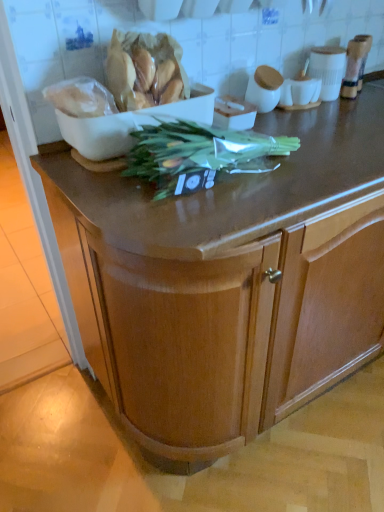
At what (x,y) coordinates should I click in order to perform the action: click on green leafy vegetable at center. Please return your answer as a coordinate pair (x, y). Looking at the image, I should click on (200, 155).

What is the approximate height of green leafy vegetable at center?

It is 13.18 centimeters.

The width and height of the screenshot is (384, 512). In order to click on white matte bowl at upper left in this screenshot , I will do `click(131, 124)`.

What do you see at coordinates (145, 70) in the screenshot? I see `translucent plastic bag of bread at upper left, the 2th food from the left` at bounding box center [145, 70].

The height and width of the screenshot is (512, 384). What do you see at coordinates (328, 69) in the screenshot?
I see `white glossy cup at upper right` at bounding box center [328, 69].

Consider the image. Measure the distance between point (325, 54) and camera.

Point (325, 54) and camera are 4.58 feet apart.

Locate an element on the screen. This screenshot has width=384, height=512. wooden cabinet at center is located at coordinates (229, 283).

Between wooden cabinet at center and white matte bowl at upper left, which one appears on the left side from the viewer's perspective?

white matte bowl at upper left.

Is white matte bowl at upper left completely or partially inside wooden cabinet at center?

Actually, white matte bowl at upper left is outside wooden cabinet at center.

From a real-world perspective, who is located lower, wooden cabinet at center or white matte bowl at upper left?

wooden cabinet at center.

Considering their positions, is wooden cabinet at center located in front of or behind white matte bowl at upper left?

wooden cabinet at center is in front of white matte bowl at upper left.

How much distance is there between white glossy cup at upper right and white matte bowl at upper left?

The distance of white glossy cup at upper right from white matte bowl at upper left is 62.50 centimeters.

Does white glossy cup at upper right have a lesser height compared to white matte bowl at upper left?

Incorrect, the height of white glossy cup at upper right does not fall short of that of white matte bowl at upper left.

Considering the relative sizes of white glossy cup at upper right and white matte bowl at upper left in the image provided, is white glossy cup at upper right wider than white matte bowl at upper left?

No, white glossy cup at upper right is not wider than white matte bowl at upper left.

From the image's perspective, is translucent plastic bag of bread at upper left, the 1th food when ordered from right to left, located above or below white plastic bag at upper left, positioned as the second food in right-to-left order?

translucent plastic bag of bread at upper left, the 1th food when ordered from right to left, is above white plastic bag at upper left, positioned as the second food in right-to-left order.

Is translucent plastic bag of bread at upper left, the 2th food from the left, looking in the opposite direction of white plastic bag at upper left, which appears as the 1th food when viewed from the left?

That's not correct — translucent plastic bag of bread at upper left, the 2th food from the left, is not looking away from white plastic bag at upper left, which appears as the 1th food when viewed from the left.

Is point (119, 59) positioned after point (69, 101)?

Yes, it is behind point (69, 101).

Is translucent plastic bag of bread at upper left, the 1th food when ordered from right to left, positioned behind white plastic bag at upper left, which appears as the 1th food when viewed from the left?

Yes, it is.

Between white plastic bag at upper left, which appears as the 1th food when viewed from the left, and translucent plastic bag of bread at upper left, the 2th food from the left, which one is positioned in front?

white plastic bag at upper left, which appears as the 1th food when viewed from the left.

Between white plastic bag at upper left, which appears as the 1th food when viewed from the left, and translucent plastic bag of bread at upper left, the 2th food from the left, which one has smaller width?

white plastic bag at upper left, which appears as the 1th food when viewed from the left.

How distant is white plastic bag at upper left, positioned as the second food in right-to-left order, from translucent plastic bag of bread at upper left, the 2th food from the left?

The distance of white plastic bag at upper left, positioned as the second food in right-to-left order, from translucent plastic bag of bread at upper left, the 2th food from the left, is 3.89 inches.

From the picture: From the image's perspective, is white plastic bag at upper left, which appears as the 1th food when viewed from the left, above translucent plastic bag of bread at upper left, the 2th food from the left?

Incorrect, from the image's perspective, white plastic bag at upper left, which appears as the 1th food when viewed from the left, is lower than translucent plastic bag of bread at upper left, the 2th food from the left.

Does point (135, 164) come in front of point (317, 52)?

Yes.

Is green leafy vegetable at center closer to the viewer compared to white glossy cup at upper right?

Yes, green leafy vegetable at center is closer to the viewer.

Is green leafy vegetable at center surrounding white glossy cup at upper right?

No, white glossy cup at upper right is located outside of green leafy vegetable at center.

Is green leafy vegetable at center shorter than white glossy cup at upper right?

Yes.

Between white plastic bag at upper left, which appears as the 1th food when viewed from the left, and white matte bowl at upper left, which one has smaller width?

Thinner between the two is white plastic bag at upper left, which appears as the 1th food when viewed from the left.

Is the position of white plastic bag at upper left, which appears as the 1th food when viewed from the left, more distant than that of white matte bowl at upper left?

No, white plastic bag at upper left, which appears as the 1th food when viewed from the left, is closer to the viewer.

From a real-world perspective, is white plastic bag at upper left, positioned as the second food in right-to-left order, physically below white matte bowl at upper left?

No, from a real-world perspective, white plastic bag at upper left, positioned as the second food in right-to-left order, is not under white matte bowl at upper left.

In terms of size, does white matte bowl at upper left appear bigger or smaller than translucent plastic bag of bread at upper left, the 2th food from the left?

white matte bowl at upper left is bigger than translucent plastic bag of bread at upper left, the 2th food from the left.

Between point (197, 116) and point (111, 41), which one is positioned in front?

The point (111, 41) is in front.

From a real-world perspective, relative to translucent plastic bag of bread at upper left, the 2th food from the left, is white matte bowl at upper left vertically above or below?

Clearly, from a real-world perspective, white matte bowl at upper left is below translucent plastic bag of bread at upper left, the 2th food from the left.

Is white matte bowl at upper left next to translucent plastic bag of bread at upper left, the 1th food when ordered from right to left?

Yes, white matte bowl at upper left is beside translucent plastic bag of bread at upper left, the 1th food when ordered from right to left.

The width and height of the screenshot is (384, 512). What are the coordinates of `cabinetry in front of the white matte bowl at upper left` in the screenshot? It's located at (229, 283).

The image size is (384, 512). In order to click on appliance located underneath the white matte bowl at upper left (from a real-world perspective) in this screenshot , I will do point(328,69).

Looking at the image, which one is located further to white plastic bag at upper left, positioned as the second food in right-to-left order, white glossy cup at upper right or white matte bowl at upper left?

Based on the image, white glossy cup at upper right appears to be further to white plastic bag at upper left, positioned as the second food in right-to-left order.

Looking at the image, which one is located closer to wooden cabinet at center, green leafy vegetable at center or white plastic bag at upper left, which appears as the 1th food when viewed from the left?

green leafy vegetable at center lies closer to wooden cabinet at center than the other object.

Which object lies further to the anchor point translucent plastic bag of bread at upper left, the 2th food from the left, green leafy vegetable at center or wooden cabinet at center?

wooden cabinet at center is positioned further to the anchor translucent plastic bag of bread at upper left, the 2th food from the left.

From the image, which object appears to be farther from wooden cabinet at center, green leafy vegetable at center or white matte bowl at upper left?

white matte bowl at upper left.

Looking at the image, which one is located closer to white glossy cup at upper right, white plastic bag at upper left, which appears as the 1th food when viewed from the left, or green leafy vegetable at center?

green leafy vegetable at center is closer to white glossy cup at upper right.

Which object lies nearer to the anchor point green leafy vegetable at center, white glossy cup at upper right or wooden cabinet at center?

The object closer to green leafy vegetable at center is wooden cabinet at center.

Consider the image. Based on their spatial positions, is white matte bowl at upper left or wooden cabinet at center further from translucent plastic bag of bread at upper left, the 1th food when ordered from right to left?

The object further to translucent plastic bag of bread at upper left, the 1th food when ordered from right to left, is wooden cabinet at center.

Based on their spatial positions, is wooden cabinet at center or green leafy vegetable at center further from white glossy cup at upper right?

Among the two, wooden cabinet at center is located further to white glossy cup at upper right.

You are a GUI agent. You are given a task and a screenshot of the screen. Output one action in this format:
    pyautogui.click(x=<x>, y=<y>)
    Task: Click on the vegetable situated between white matte bowl at upper left and wooden cabinet at center from left to right
    The image size is (384, 512).
    Given the screenshot: What is the action you would take?
    pyautogui.click(x=200, y=155)

At what (x,y) coordinates should I click in order to perform the action: click on vegetable between translucent plastic bag of bread at upper left, the 1th food when ordered from right to left, and white glossy cup at upper right, in the horizontal direction. Please return your answer as a coordinate pair (x, y). The width and height of the screenshot is (384, 512). Looking at the image, I should click on (200, 155).

Find the location of `food between white matte bowl at upper left and white glossy cup at upper right in the horizontal direction`. food between white matte bowl at upper left and white glossy cup at upper right in the horizontal direction is located at coordinates (145, 70).

You are a GUI agent. You are given a task and a screenshot of the screen. Output one action in this format:
    pyautogui.click(x=<x>, y=<y>)
    Task: Click on the food between white plastic bag at upper left, which appears as the 1th food when viewed from the left, and white glossy cup at upper right, in the horizontal direction
    The image size is (384, 512).
    Given the screenshot: What is the action you would take?
    pyautogui.click(x=145, y=70)